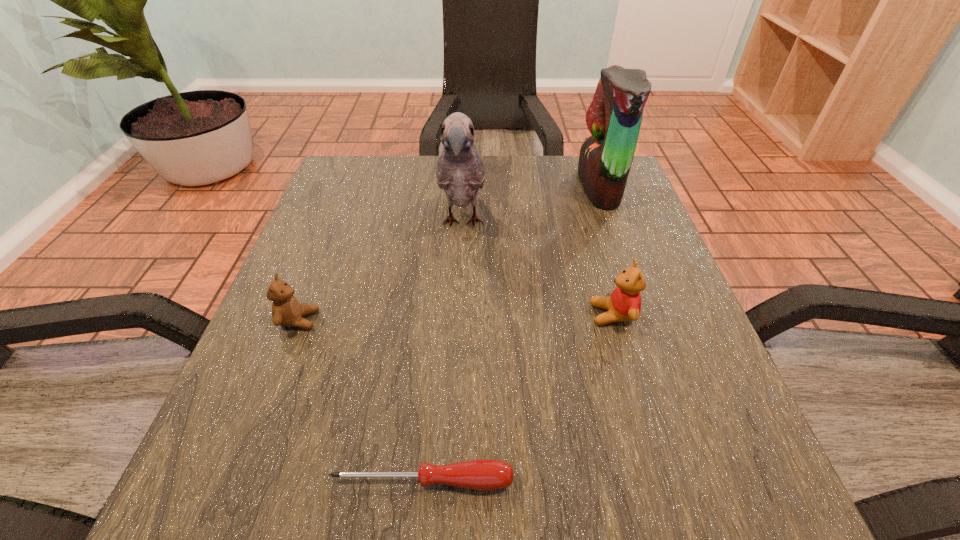
I want to click on vacant area between the left parrot and the right teddy bear, so click(538, 269).

Identify the location of free space between the left parrot and the nearest object. (443, 352).

You are a GUI agent. You are given a task and a screenshot of the screen. Output one action in this format:
    pyautogui.click(x=<x>, y=<y>)
    Task: Click on the vacant space that's between the left parrot and the shortest object
    This screenshot has width=960, height=540.
    Given the screenshot: What is the action you would take?
    click(443, 352)

Identify the location of vacant region between the right teddy bear and the screwdriver. The image size is (960, 540). [x=517, y=397].

You are a GUI agent. You are given a task and a screenshot of the screen. Output one action in this format:
    pyautogui.click(x=<x>, y=<y>)
    Task: Click on the empty location between the right parrot and the left teddy bear
    The image size is (960, 540).
    Given the screenshot: What is the action you would take?
    pyautogui.click(x=449, y=254)

The width and height of the screenshot is (960, 540). Identify the location of free space between the left teddy bear and the screwdriver. (361, 400).

Image resolution: width=960 pixels, height=540 pixels. I want to click on object that is the closest to the screwdriver, so click(286, 310).

This screenshot has width=960, height=540. I want to click on the closest object to the left parrot, so click(624, 304).

This screenshot has height=540, width=960. Find the location of `free spot that satisfies the following two spatial constraints: 1. on the front-facing side of the left parrot; 2. on the front-facing side of the shorter teddy bear`. free spot that satisfies the following two spatial constraints: 1. on the front-facing side of the left parrot; 2. on the front-facing side of the shorter teddy bear is located at coordinates (458, 320).

Where is `vacant space that satisfies the following two spatial constraints: 1. on the front-facing side of the right teddy bear; 2. on the front side of the screwdriver`? This screenshot has width=960, height=540. vacant space that satisfies the following two spatial constraints: 1. on the front-facing side of the right teddy bear; 2. on the front side of the screwdriver is located at coordinates (660, 481).